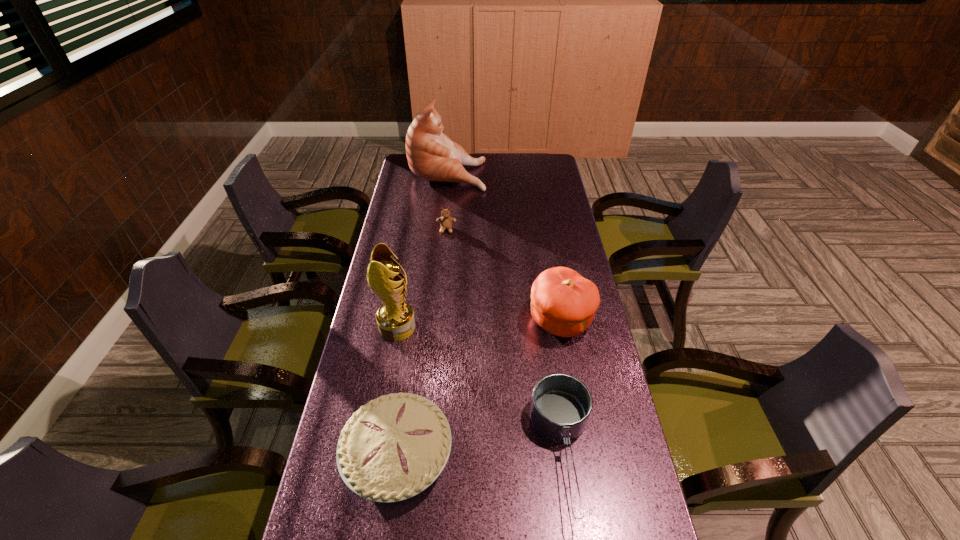
The width and height of the screenshot is (960, 540). I want to click on cat, so click(x=432, y=155).

Identify the location of award. (395, 318).

What are the coordinates of `the third tallest object` in the screenshot? It's located at (563, 302).

The height and width of the screenshot is (540, 960). I want to click on pie, so (x=394, y=447).

Find the location of `teddy bear`. teddy bear is located at coordinates (446, 221).

Identify the location of saucepan. (561, 404).

You are a GUI agent. You are given a task and a screenshot of the screen. Output one action in this format:
    pyautogui.click(x=<x>, y=<y>)
    Task: Click on the free location located on the face of the farthest object
    The width and height of the screenshot is (960, 540).
    Given the screenshot: What is the action you would take?
    pyautogui.click(x=521, y=172)

Find the location of a particular element. vacant region located 0.090m on the front-facing side of the award is located at coordinates (444, 327).

You are a GUI agent. You are given a task and a screenshot of the screen. Output one action in this format:
    pyautogui.click(x=<x>, y=<y>)
    Task: Click on the free region located 0.050m on the front of the fourth shortest object
    The height and width of the screenshot is (540, 960).
    Given the screenshot: What is the action you would take?
    pyautogui.click(x=567, y=361)

Where is `vacant space located on the back of the pie`? vacant space located on the back of the pie is located at coordinates (411, 360).